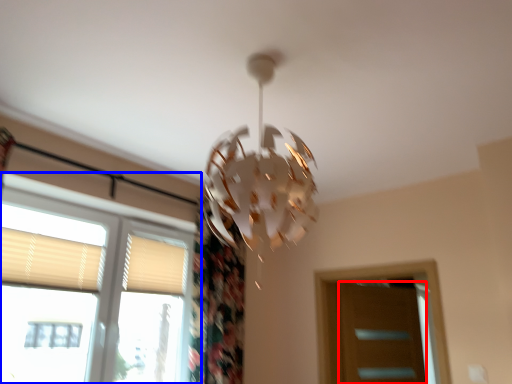
Question: Which object is closer to the camera taking this photo, screen door (highlighted by a red box) or window (highlighted by a blue box)?

Choices:
 (A) screen door
 (B) window

Answer: (B)